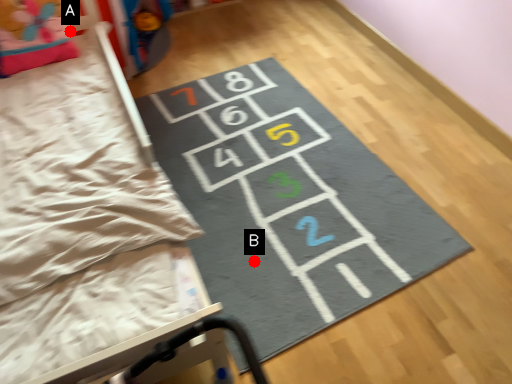
Question: Two points are circled on the image, labeled by A and B beside each circle. Which of the following is the closest to the observer?

Choices:
 (A) A is closer
 (B) B is closer

Answer: (B)